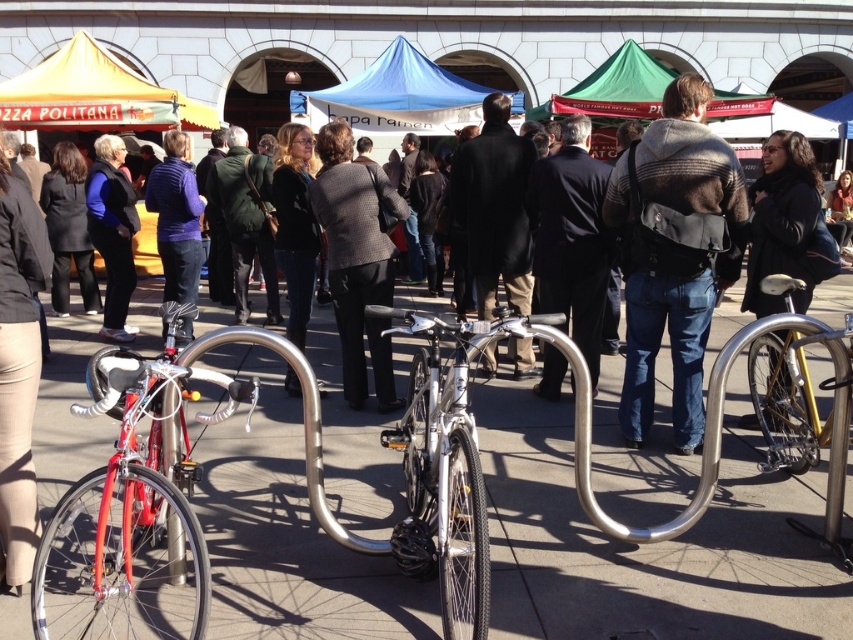
Question: Which object appears farthest from the camera in this image?

Choices:
 (A) matte purple sweater at center
 (B) beige fabric skirt at lower left
 (C) purple fleece jacket at center
 (D) dark gray sweater at center

Answer: (C)

Question: Which point is closer to the camera?

Choices:
 (A) denim jacket at center
 (B) black fabric coat at center

Answer: (B)

Question: Observing the image, what is the correct spatial positioning of metallic silver bike rack at center in reference to shiny red bicycle at lower left?

Choices:
 (A) below
 (B) above

Answer: (A)

Question: Which of the following is the closest to the observer?

Choices:
 (A) (1, 204)
 (B) (744, 588)
 (C) (740, 96)
 (D) (160, 227)

Answer: (A)

Question: Does silver metallic bicycle at center lie in front of denim jacket at center?

Choices:
 (A) no
 (B) yes

Answer: (B)

Question: Does yellow fabric canopy at upper left appear on the left side of black fabric coat at center?

Choices:
 (A) yes
 (B) no

Answer: (A)